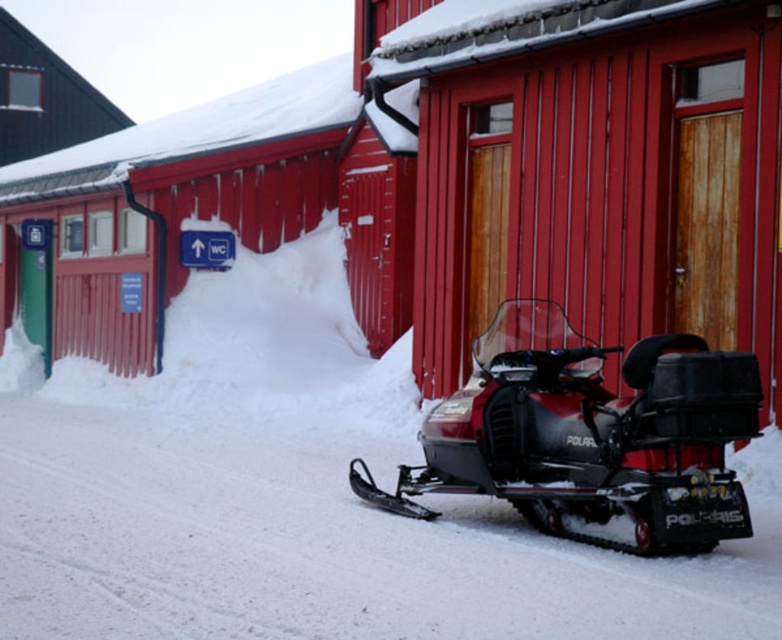
Question: Among these objects, which one is farthest from the camera?

Choices:
 (A) smooth wood door at center
 (B) shiny black snowmobile at center

Answer: (A)

Question: Which object appears closest to the camera in this image?

Choices:
 (A) smooth wood door at center
 (B) shiny black snowmobile at center

Answer: (B)

Question: Can you confirm if smooth wood door at center is bigger than shiny black snowmobile at center?

Choices:
 (A) yes
 (B) no

Answer: (B)

Question: Can you confirm if smooth wood door at center is thinner than shiny black snowmobile at center?

Choices:
 (A) yes
 (B) no

Answer: (A)

Question: Which of the following is the closest to the observer?

Choices:
 (A) (628, 72)
 (B) (691, 378)

Answer: (B)

Question: Can you confirm if smooth wood door at center is bigger than shiny black snowmobile at center?

Choices:
 (A) no
 (B) yes

Answer: (A)